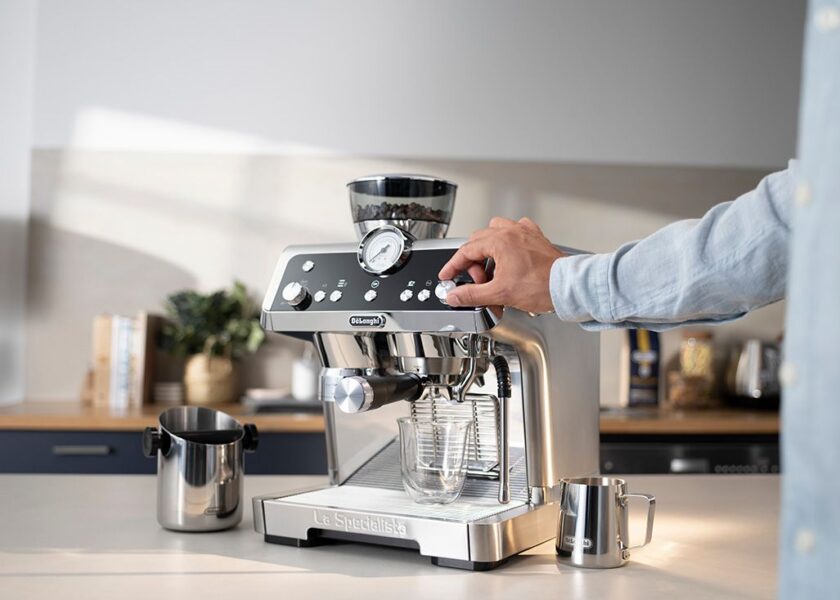
At what (x,y) coordinates should I click in order to perform the action: click on drawers. Please return your answer as a coordinate pair (x, y). This screenshot has width=840, height=600. Looking at the image, I should click on (37, 445), (284, 458).